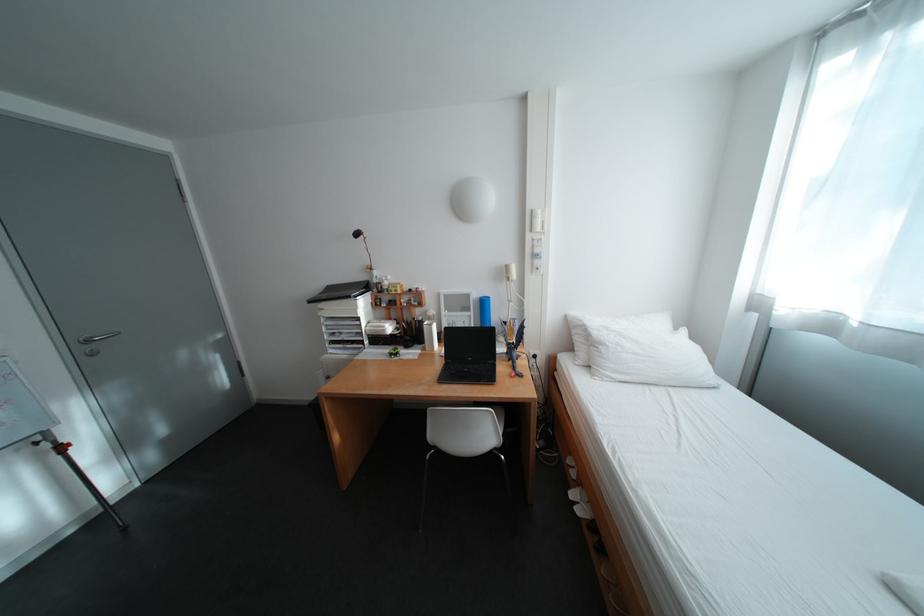
Describe the element at coordinates (62, 447) in the screenshot. Image resolution: width=924 pixels, height=616 pixels. I see `the red adjustment knob` at that location.